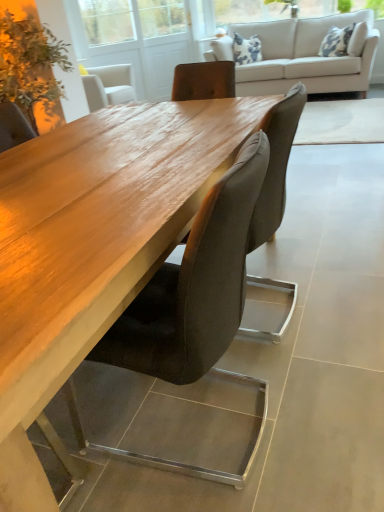
In order to face transparent glass screen door at upper center, should I rotate leftwards or rightwards?

To face it directly, rotate left by 6.287 degrees.

Locate an element on the screen. transparent glass screen door at upper center is located at coordinates (135, 39).

At what (x,y) coordinates should I click in order to perform the action: click on suede-like brown chair at center, marked as the first chair in a back-to-front arrangement. Please return your answer as a coordinate pair (x, y). Looking at the image, I should click on (276, 166).

Image resolution: width=384 pixels, height=512 pixels. What do you see at coordinates (276, 166) in the screenshot?
I see `suede-like brown chair at center, arranged as the second chair when viewed from the front` at bounding box center [276, 166].

Where is `beige fabric couch at upper center`? The width and height of the screenshot is (384, 512). beige fabric couch at upper center is located at coordinates (302, 55).

What are the coordinates of `green leafy plant at upper left` in the screenshot? It's located at (30, 65).

I want to click on transparent glass screen door at upper center, so click(135, 39).

In the scene shown: Choose the correct answer: Is transparent glass screen door at upper center inside suede-like brown chair at center, the first chair in the front-to-back sequence, or outside it?

transparent glass screen door at upper center is outside suede-like brown chair at center, the first chair in the front-to-back sequence.

Between transparent glass screen door at upper center and suede-like brown chair at center, the first chair in the front-to-back sequence, which one has smaller width?

transparent glass screen door at upper center.

Is transparent glass screen door at upper center positioned far away from suede-like brown chair at center, arranged as the 2th chair when viewed from the back?

Absolutely, transparent glass screen door at upper center is distant from suede-like brown chair at center, arranged as the 2th chair when viewed from the back.

Does beige fabric couch at upper center lie behind suede-like brown chair at center, arranged as the second chair when viewed from the front?

Yes, beige fabric couch at upper center is further from the camera.

Is beige fabric couch at upper center not close to suede-like brown chair at center, arranged as the second chair when viewed from the front?

Yes, beige fabric couch at upper center and suede-like brown chair at center, arranged as the second chair when viewed from the front, are quite far apart.

From the picture: Who is taller, beige fabric couch at upper center or suede-like brown chair at center, arranged as the second chair when viewed from the front?

With more height is beige fabric couch at upper center.

From a real-world perspective, who is located lower, beige fabric couch at upper center or suede-like brown chair at center, marked as the first chair in a back-to-front arrangement?

From a 3D spatial view, suede-like brown chair at center, marked as the first chair in a back-to-front arrangement, is below.

In the scene shown: Would you say beige fabric couch at upper center is outside green leafy plant at upper left?

Yes.

Can you see beige fabric couch at upper center touching green leafy plant at upper left?

No, beige fabric couch at upper center is not beside green leafy plant at upper left.

Between beige fabric couch at upper center and green leafy plant at upper left, which one is positioned in front?

green leafy plant at upper left is more forward.

Is point (316, 68) closer or farther from the camera than point (58, 97)?

Point (316, 68) is positioned farther from the camera compared to point (58, 97).

Considering the sizes of beige fabric couch at upper center and transparent glass screen door at upper center in the image, is beige fabric couch at upper center taller or shorter than transparent glass screen door at upper center?

Clearly, beige fabric couch at upper center is shorter compared to transparent glass screen door at upper center.

Is beige fabric couch at upper center beside transparent glass screen door at upper center?

No, beige fabric couch at upper center is not making contact with transparent glass screen door at upper center.

From the image's perspective, who appears lower, beige fabric couch at upper center or transparent glass screen door at upper center?

beige fabric couch at upper center.

Considering the relative sizes of beige fabric couch at upper center and transparent glass screen door at upper center in the image provided, is beige fabric couch at upper center smaller than transparent glass screen door at upper center?

Actually, beige fabric couch at upper center might be larger than transparent glass screen door at upper center.

From a real-world perspective, who is located higher, green leafy plant at upper left or suede-like brown chair at center, arranged as the 2th chair when viewed from the back?

green leafy plant at upper left is physically above.

Is green leafy plant at upper left taller than suede-like brown chair at center, the first chair in the front-to-back sequence?

Indeed, green leafy plant at upper left has a greater height compared to suede-like brown chair at center, the first chair in the front-to-back sequence.

Is green leafy plant at upper left far from suede-like brown chair at center, the first chair in the front-to-back sequence?

Yes, green leafy plant at upper left and suede-like brown chair at center, the first chair in the front-to-back sequence, are located far from each other.

In the scene shown: Is green leafy plant at upper left wider or thinner than suede-like brown chair at center, the first chair in the front-to-back sequence?

green leafy plant at upper left is wider than suede-like brown chair at center, the first chair in the front-to-back sequence.

Are suede-like brown chair at center, arranged as the 2th chair when viewed from the back, and suede-like brown chair at center, arranged as the second chair when viewed from the front, located far from each other?

suede-like brown chair at center, arranged as the 2th chair when viewed from the back, is actually quite close to suede-like brown chair at center, arranged as the second chair when viewed from the front.

Visually, is suede-like brown chair at center, the first chair in the front-to-back sequence, positioned to the left or to the right of suede-like brown chair at center, marked as the first chair in a back-to-front arrangement?

suede-like brown chair at center, the first chair in the front-to-back sequence, is positioned on suede-like brown chair at center, marked as the first chair in a back-to-front arrangement,'s left side.

From a real-world perspective, which object stands above the other?

suede-like brown chair at center, the first chair in the front-to-back sequence, from a real-world perspective.

Is suede-like brown chair at center, arranged as the 2th chair when viewed from the back, oriented towards suede-like brown chair at center, marked as the first chair in a back-to-front arrangement?

No.

Can you confirm if beige fabric couch at upper center is bigger than suede-like brown chair at center, the first chair in the front-to-back sequence?

Yes.

Does beige fabric couch at upper center contain suede-like brown chair at center, the first chair in the front-to-back sequence?

Actually, suede-like brown chair at center, the first chair in the front-to-back sequence, is outside beige fabric couch at upper center.

From the image's perspective, is beige fabric couch at upper center over suede-like brown chair at center, the first chair in the front-to-back sequence?

Yes, from the image's perspective, beige fabric couch at upper center is over suede-like brown chair at center, the first chair in the front-to-back sequence.

In the scene shown: Relative to suede-like brown chair at center, the first chair in the front-to-back sequence, is beige fabric couch at upper center in front or behind?

In the image, beige fabric couch at upper center appears behind suede-like brown chair at center, the first chair in the front-to-back sequence.

The height and width of the screenshot is (512, 384). Find the location of `the 1st chair directly beneath the transparent glass screen door at upper center (from a real-world perspective)`. the 1st chair directly beneath the transparent glass screen door at upper center (from a real-world perspective) is located at coordinates (194, 286).

This screenshot has width=384, height=512. What are the coordinates of `studio couch on the right of the suede-like brown chair at center, arranged as the second chair when viewed from the front` in the screenshot? It's located at (302, 55).

Based on their spatial positions, is transparent glass screen door at upper center or green leafy plant at upper left further from suede-like brown chair at center, the first chair in the front-to-back sequence?

Among the two, transparent glass screen door at upper center is located further to suede-like brown chair at center, the first chair in the front-to-back sequence.

Looking at the image, which one is located further to green leafy plant at upper left, beige fabric couch at upper center or transparent glass screen door at upper center?

beige fabric couch at upper center is further to green leafy plant at upper left.

Based on their spatial positions, is suede-like brown chair at center, the first chair in the front-to-back sequence, or suede-like brown chair at center, arranged as the second chair when viewed from the front, further from green leafy plant at upper left?

suede-like brown chair at center, the first chair in the front-to-back sequence, is positioned further to the anchor green leafy plant at upper left.

From the image, which object appears to be farther from suede-like brown chair at center, arranged as the second chair when viewed from the front, green leafy plant at upper left or suede-like brown chair at center, arranged as the 2th chair when viewed from the back?

green leafy plant at upper left is positioned further to the anchor suede-like brown chair at center, arranged as the second chair when viewed from the front.

When comparing their distances from green leafy plant at upper left, does suede-like brown chair at center, the first chair in the front-to-back sequence, or beige fabric couch at upper center seem further?

The object further to green leafy plant at upper left is suede-like brown chair at center, the first chair in the front-to-back sequence.

Estimate the real-world distances between objects in this image. Which object is closer to beige fabric couch at upper center, transparent glass screen door at upper center or green leafy plant at upper left?

Based on the image, transparent glass screen door at upper center appears to be nearer to beige fabric couch at upper center.

When comparing their distances from green leafy plant at upper left, does beige fabric couch at upper center or suede-like brown chair at center, arranged as the 2th chair when viewed from the back, seem further?

Among the two, suede-like brown chair at center, arranged as the 2th chair when viewed from the back, is located further to green leafy plant at upper left.

Looking at the image, which one is located closer to green leafy plant at upper left, suede-like brown chair at center, arranged as the 2th chair when viewed from the back, or transparent glass screen door at upper center?

The object closer to green leafy plant at upper left is transparent glass screen door at upper center.

Locate an element on the screen. This screenshot has height=512, width=384. chair between suede-like brown chair at center, the first chair in the front-to-back sequence, and green leafy plant at upper left in the front-back direction is located at coordinates (276, 166).

Locate an element on the screen. The image size is (384, 512). plant between suede-like brown chair at center, marked as the first chair in a back-to-front arrangement, and beige fabric couch at upper center from front to back is located at coordinates (30, 65).

Locate an element on the screen. plant between suede-like brown chair at center, marked as the first chair in a back-to-front arrangement, and transparent glass screen door at upper center from front to back is located at coordinates (30, 65).

The width and height of the screenshot is (384, 512). Identify the location of chair located between suede-like brown chair at center, the first chair in the front-to-back sequence, and transparent glass screen door at upper center in the depth direction. point(276,166).